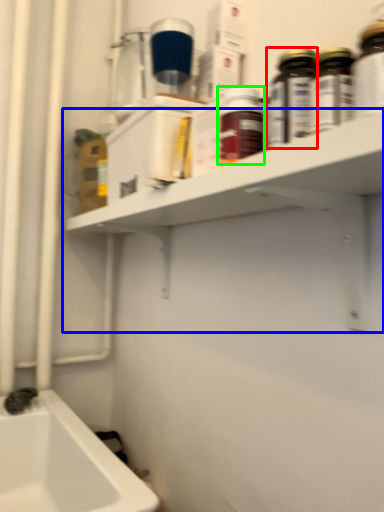
Question: Which is nearer to the bottle (highlighted by a red box)? shelf (highlighted by a blue box) or bottle (highlighted by a green box).

Choices:
 (A) shelf
 (B) bottle

Answer: (B)